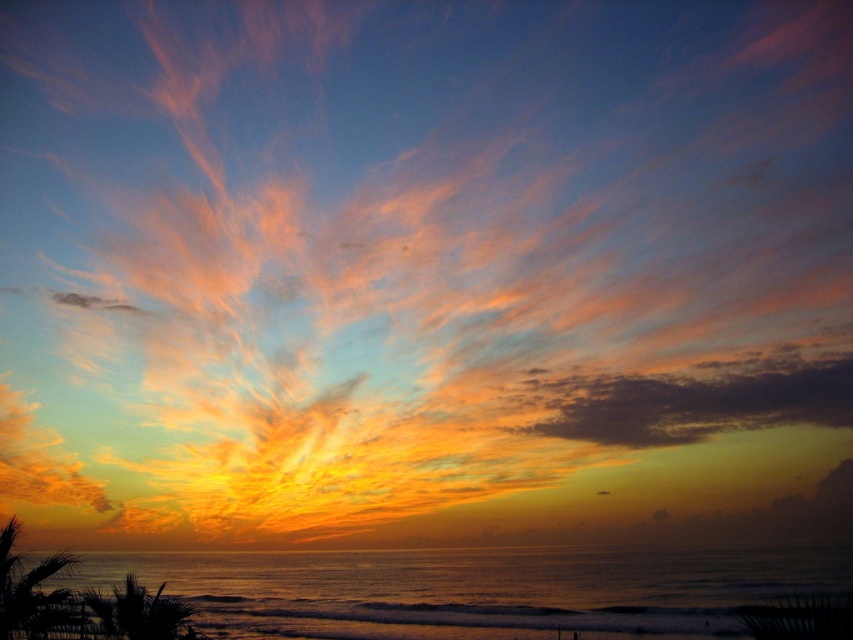
Question: Is silvery water at lower center positioned at the back of dark orange textured clouds at upper right?

Choices:
 (A) no
 (B) yes

Answer: (A)

Question: Considering the relative positions of silvery water at lower center and dark orange textured clouds at upper right in the image provided, where is silvery water at lower center located with respect to dark orange textured clouds at upper right?

Choices:
 (A) below
 (B) above

Answer: (A)

Question: Which point is closer to the camera taking this photo?

Choices:
 (A) (630, 376)
 (B) (322, 552)

Answer: (B)

Question: Is silvery water at lower center wider than dark orange textured clouds at upper right?

Choices:
 (A) no
 (B) yes

Answer: (B)